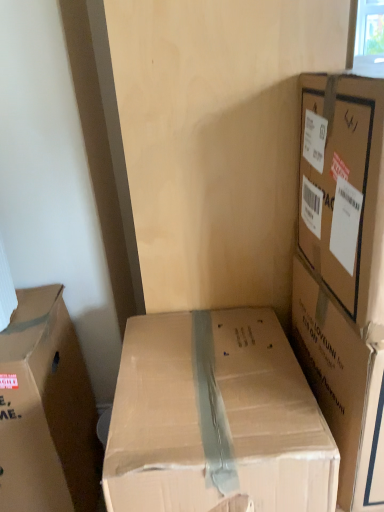
How much space does brown cardboard box at left, which appears as the 1th box when viewed from the left, occupy horizontally?

brown cardboard box at left, which appears as the 1th box when viewed from the left, is 17.83 inches wide.

What is the approximate width of brown cardboard box at center, the second box viewed from the right?

It is 21.82 inches.

I want to click on brown cardboard box at left, the third box viewed from the right, so click(46, 411).

Consider the image. From a real-world perspective, is brown cardboard box at center, the second box viewed from the right, under brown cardboard box at upper right, which ranks as the third box in left-to-right order?

Yes, from a real-world perspective, brown cardboard box at center, the second box viewed from the right, is beneath brown cardboard box at upper right, which ranks as the third box in left-to-right order.

Does brown cardboard box at center, the second box viewed from the left, have a lesser height compared to brown cardboard box at upper right, the first box positioned from the right?

In fact, brown cardboard box at center, the second box viewed from the left, may be taller than brown cardboard box at upper right, the first box positioned from the right.

Is brown cardboard box at center, the second box viewed from the right, to the left of brown cardboard box at upper right, the first box positioned from the right, from the viewer's perspective?

Correct, you'll find brown cardboard box at center, the second box viewed from the right, to the left of brown cardboard box at upper right, the first box positioned from the right.

Which of these two, brown cardboard box at center, the second box viewed from the left, or brown cardboard box at upper right, the first box positioned from the right, is smaller?

brown cardboard box at upper right, the first box positioned from the right, is smaller.

Does brown cardboard box at upper right, the first box positioned from the right, touch brown cardboard box at left, which appears as the 1th box when viewed from the left?

No, brown cardboard box at upper right, the first box positioned from the right, is not in contact with brown cardboard box at left, which appears as the 1th box when viewed from the left.

From the image's perspective, is brown cardboard box at upper right, which ranks as the third box in left-to-right order, over brown cardboard box at left, which appears as the 1th box when viewed from the left?

Yes, from the image's perspective, brown cardboard box at upper right, which ranks as the third box in left-to-right order, is above brown cardboard box at left, which appears as the 1th box when viewed from the left.

Considering the relative sizes of brown cardboard box at upper right, the first box positioned from the right, and brown cardboard box at left, which appears as the 1th box when viewed from the left, in the image provided, is brown cardboard box at upper right, the first box positioned from the right, bigger than brown cardboard box at left, which appears as the 1th box when viewed from the left,?

Incorrect, brown cardboard box at upper right, the first box positioned from the right, is not larger than brown cardboard box at left, which appears as the 1th box when viewed from the left.

In order to click on box on the right of brown cardboard box at center, the second box viewed from the left in this screenshot , I will do `click(343, 272)`.

From the image's perspective, which is below, brown cardboard box at upper right, the first box positioned from the right, or brown cardboard box at center, the second box viewed from the right?

From the image's view, brown cardboard box at center, the second box viewed from the right, is below.

Considering the relative sizes of brown cardboard box at upper right, the first box positioned from the right, and brown cardboard box at center, the second box viewed from the left, in the image provided, is brown cardboard box at upper right, the first box positioned from the right, smaller than brown cardboard box at center, the second box viewed from the left,?

Yes, brown cardboard box at upper right, the first box positioned from the right, is smaller than brown cardboard box at center, the second box viewed from the left.

Is brown cardboard box at center, the second box viewed from the right, touching brown cardboard box at left, the third box viewed from the right?

No, brown cardboard box at center, the second box viewed from the right, is not next to brown cardboard box at left, the third box viewed from the right.

Considering the relative positions of brown cardboard box at center, the second box viewed from the left, and brown cardboard box at left, the third box viewed from the right, in the image provided, is brown cardboard box at center, the second box viewed from the left, to the left of brown cardboard box at left, the third box viewed from the right, from the viewer's perspective?

No.

Based on the photo, is brown cardboard box at left, which appears as the 1th box when viewed from the left, at the back of brown cardboard box at center, the second box viewed from the right?

That's not correct — brown cardboard box at center, the second box viewed from the right, is not looking away from brown cardboard box at left, which appears as the 1th box when viewed from the left.

In the scene shown: From a real-world perspective, which is physically below, brown cardboard box at left, the third box viewed from the right, or brown cardboard box at upper right, the first box positioned from the right?

From a 3D spatial view, brown cardboard box at left, the third box viewed from the right, is below.

Does brown cardboard box at left, the third box viewed from the right, lie in front of brown cardboard box at upper right, which ranks as the third box in left-to-right order?

No, it is not.

Is brown cardboard box at left, which appears as the 1th box when viewed from the left, placed right next to brown cardboard box at upper right, which ranks as the third box in left-to-right order?

No, brown cardboard box at left, which appears as the 1th box when viewed from the left, is not with brown cardboard box at upper right, which ranks as the third box in left-to-right order.

Is brown cardboard box at left, the third box viewed from the right, oriented away from brown cardboard box at upper right, which ranks as the third box in left-to-right order?

No, brown cardboard box at left, the third box viewed from the right, is not facing away from brown cardboard box at upper right, which ranks as the third box in left-to-right order.

Can you confirm if brown cardboard box at left, which appears as the 1th box when viewed from the left, is taller than brown cardboard box at center, the second box viewed from the left?

In fact, brown cardboard box at left, which appears as the 1th box when viewed from the left, may be shorter than brown cardboard box at center, the second box viewed from the left.

Is brown cardboard box at left, which appears as the 1th box when viewed from the left, not near brown cardboard box at center, the second box viewed from the left?

No, brown cardboard box at left, which appears as the 1th box when viewed from the left, is not far away from brown cardboard box at center, the second box viewed from the left.

Is brown cardboard box at left, the third box viewed from the right, oriented towards brown cardboard box at center, the second box viewed from the left?

No, brown cardboard box at left, the third box viewed from the right, is not turned towards brown cardboard box at center, the second box viewed from the left.

From a real-world perspective, count 2nd boxs downward from the brown cardboard box at upper right, which ranks as the third box in left-to-right order, and point to it. Please provide its 2D coordinates.

[(215, 418)]

Starting from the brown cardboard box at upper right, which ranks as the third box in left-to-right order, which box is the 2nd one to the left? Please provide its 2D coordinates.

[(46, 411)]

Considering their positions, is brown cardboard box at upper right, which ranks as the third box in left-to-right order, positioned closer to brown cardboard box at center, the second box viewed from the right, than brown cardboard box at left, the third box viewed from the right?

Based on the image, brown cardboard box at upper right, which ranks as the third box in left-to-right order, appears to be nearer to brown cardboard box at center, the second box viewed from the right.

Based on their spatial positions, is brown cardboard box at left, the third box viewed from the right, or brown cardboard box at upper right, the first box positioned from the right, further from brown cardboard box at center, the second box viewed from the left?

brown cardboard box at left, the third box viewed from the right, lies further to brown cardboard box at center, the second box viewed from the left, than the other object.

Considering their positions, is brown cardboard box at left, the third box viewed from the right, positioned closer to brown cardboard box at upper right, the first box positioned from the right, than brown cardboard box at center, the second box viewed from the right?

Based on the image, brown cardboard box at center, the second box viewed from the right, appears to be nearer to brown cardboard box at upper right, the first box positioned from the right.

Considering their positions, is brown cardboard box at center, the second box viewed from the left, positioned further to brown cardboard box at upper right, which ranks as the third box in left-to-right order, than brown cardboard box at left, which appears as the 1th box when viewed from the left?

The object further to brown cardboard box at upper right, which ranks as the third box in left-to-right order, is brown cardboard box at left, which appears as the 1th box when viewed from the left.

Estimate the real-world distances between objects in this image. Which object is closer to brown cardboard box at left, which appears as the 1th box when viewed from the left, brown cardboard box at center, the second box viewed from the left, or brown cardboard box at upper right, which ranks as the third box in left-to-right order?

Based on the image, brown cardboard box at center, the second box viewed from the left, appears to be nearer to brown cardboard box at left, which appears as the 1th box when viewed from the left.

Estimate the real-world distances between objects in this image. Which object is further from brown cardboard box at left, which appears as the 1th box when viewed from the left, brown cardboard box at upper right, which ranks as the third box in left-to-right order, or brown cardboard box at center, the second box viewed from the right?

brown cardboard box at upper right, which ranks as the third box in left-to-right order.

This screenshot has width=384, height=512. What are the coordinates of `box between brown cardboard box at left, which appears as the 1th box when viewed from the left, and brown cardboard box at upper right, which ranks as the third box in left-to-right order, in the horizontal direction` in the screenshot? It's located at (215, 418).